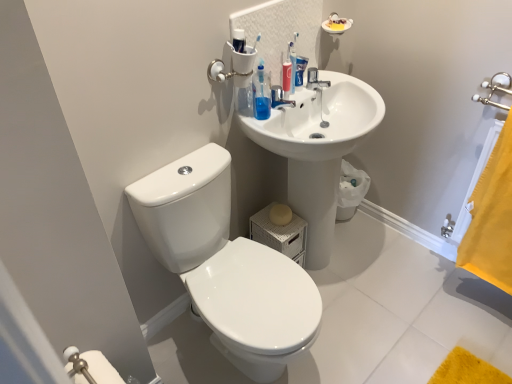
Image resolution: width=512 pixels, height=384 pixels. What do you see at coordinates (318, 150) in the screenshot?
I see `white glossy sink at upper right` at bounding box center [318, 150].

This screenshot has width=512, height=384. What do you see at coordinates (315, 80) in the screenshot? I see `metallic silver faucet at upper center` at bounding box center [315, 80].

What do you see at coordinates (226, 265) in the screenshot? I see `white glossy toilet at lower left` at bounding box center [226, 265].

I want to click on white glossy sink at upper right, so click(x=318, y=150).

Is metallic silver faucet at upper center at the back of yellow fabric towel at right?

No, yellow fabric towel at right is not facing away from metallic silver faucet at upper center.

Identify the location of curtain below the metallic silver faucet at upper center (from the image's perspective). (492, 218).

Considering the positions of objects yellow fabric towel at right and metallic silver faucet at upper center in the image provided, who is more to the right, yellow fabric towel at right or metallic silver faucet at upper center?

yellow fabric towel at right.

Does yellow fabric towel at right touch metallic silver faucet at upper center?

No.

From the image's perspective, which one is positioned lower, blue matte toothpaste tube at upper center or white glossy sink at upper right?

white glossy sink at upper right is shown below in the image.

Considering the positions of point (301, 62) and point (267, 145), is point (301, 62) closer or farther from the camera than point (267, 145)?

Point (301, 62) is positioned farther from the camera compared to point (267, 145).

Does blue matte toothpaste tube at upper center appear on the left side of white glossy sink at upper right?

Indeed, blue matte toothpaste tube at upper center is positioned on the left side of white glossy sink at upper right.

Can you confirm if blue matte toothpaste tube at upper center is bigger than white glossy sink at upper right?

Incorrect, blue matte toothpaste tube at upper center is not larger than white glossy sink at upper right.

Is yellow fabric towel at right facing towards white glossy sink at upper right?

No, yellow fabric towel at right is not turned towards white glossy sink at upper right.

Which point is more forward, (493, 163) or (353, 85)?

Positioned in front is point (493, 163).

Based on the photo, how distant is yellow fabric towel at right from white glossy sink at upper right?

yellow fabric towel at right is 23.45 inches from white glossy sink at upper right.

Is yellow fabric towel at right beside white glossy sink at upper right?

They are not placed beside each other.

Considering the relative sizes of white glossy toilet at lower left and yellow fabric towel at right in the image provided, is white glossy toilet at lower left shorter than yellow fabric towel at right?

No, white glossy toilet at lower left is not shorter than yellow fabric towel at right.

Visually, is white glossy toilet at lower left positioned to the left or to the right of yellow fabric towel at right?

white glossy toilet at lower left is to the left of yellow fabric towel at right.

Is white glossy toilet at lower left in front of or behind yellow fabric towel at right in the image?

white glossy toilet at lower left is positioned closer to the viewer than yellow fabric towel at right.

Is blue matte toothpaste tube at upper center completely or partially inside white glossy sink at upper right?

No, blue matte toothpaste tube at upper center is not inside white glossy sink at upper right.

From the image's perspective, is white glossy sink at upper right located above blue matte toothpaste tube at upper center?

No, from the image's perspective, white glossy sink at upper right is not above blue matte toothpaste tube at upper center.

Is the position of white glossy sink at upper right less distant than that of blue matte toothpaste tube at upper center?

Yes.

Which of these two, white glossy sink at upper right or blue matte toothpaste tube at upper center, is smaller?

blue matte toothpaste tube at upper center is smaller.

From a real-world perspective, is metallic silver faucet at upper center above or below white glossy toilet at lower left?

metallic silver faucet at upper center is situated higher than white glossy toilet at lower left in the real world.

From the image's perspective, is metallic silver faucet at upper center located above or below white glossy toilet at lower left?

Based on their image positions, metallic silver faucet at upper center is located above white glossy toilet at lower left.

Is metallic silver faucet at upper center aimed at white glossy toilet at lower left?

No, metallic silver faucet at upper center is not aimed at white glossy toilet at lower left.

Does metallic silver faucet at upper center have a lesser height compared to white glossy toilet at lower left?

Yes.

In the image, there is a metallic silver faucet at upper center. Identify the location of sink below it (from a real-world perspective). Image resolution: width=512 pixels, height=384 pixels. (318, 150).

Consider the image. Which is more to the right, metallic silver faucet at upper center or white glossy sink at upper right?

Positioned to the right is white glossy sink at upper right.

Which is closer, (307, 72) or (315, 203)?

Clearly, point (307, 72) is closer to the camera than point (315, 203).

Where is `curtain below the metallic silver faucet at upper center (from a real-world perspective)`? The image size is (512, 384). curtain below the metallic silver faucet at upper center (from a real-world perspective) is located at coordinates (492, 218).

At what (x,y) coordinates should I click in order to perform the action: click on sink that appears below the blue matte toothpaste tube at upper center (from the image's perspective). Please return your answer as a coordinate pair (x, y). This screenshot has height=384, width=512. Looking at the image, I should click on (318, 150).

From the image, which object appears to be farther from white glossy toilet at lower left, white glossy sink at upper right or yellow fabric towel at right?

The object further to white glossy toilet at lower left is yellow fabric towel at right.

Consider the image. When comparing their distances from blue matte toothpaste tube at upper center, does white glossy sink at upper right or white glossy toilet at lower left seem closer?

white glossy sink at upper right is closer to blue matte toothpaste tube at upper center.

Which object lies further to the anchor point white glossy sink at upper right, metallic silver faucet at upper center or blue matte toothpaste tube at upper center?

The object further to white glossy sink at upper right is blue matte toothpaste tube at upper center.

Considering their positions, is yellow fabric towel at right positioned closer to white glossy toilet at lower left than blue matte toothpaste tube at upper center?

Among the two, blue matte toothpaste tube at upper center is located nearer to white glossy toilet at lower left.

Based on their spatial positions, is yellow fabric towel at right or metallic silver faucet at upper center closer to blue matte toothpaste tube at upper center?

The object closer to blue matte toothpaste tube at upper center is metallic silver faucet at upper center.

Considering their positions, is white glossy sink at upper right positioned closer to yellow fabric towel at right than white glossy toilet at lower left?

white glossy sink at upper right.

Looking at the image, which one is located further to yellow fabric towel at right, blue matte toothpaste tube at upper center or white glossy sink at upper right?

Based on the image, blue matte toothpaste tube at upper center appears to be further to yellow fabric towel at right.

Considering their positions, is white glossy toilet at lower left positioned further to white glossy sink at upper right than blue matte toothpaste tube at upper center?

white glossy toilet at lower left lies further to white glossy sink at upper right than the other object.

Locate an element on the screen. tap between blue matte toothpaste tube at upper center and yellow fabric towel at right is located at coordinates (315, 80).

Where is `sink located between white glossy toilet at lower left and yellow fabric towel at right in the left-right direction`? Image resolution: width=512 pixels, height=384 pixels. sink located between white glossy toilet at lower left and yellow fabric towel at right in the left-right direction is located at coordinates (318, 150).

I want to click on tap between blue matte toothpaste tube at upper center and white glossy toilet at lower left vertically, so click(x=315, y=80).

Find the location of a particular element. The width and height of the screenshot is (512, 384). sink between blue matte toothpaste tube at upper center and white glossy toilet at lower left in the vertical direction is located at coordinates (318, 150).